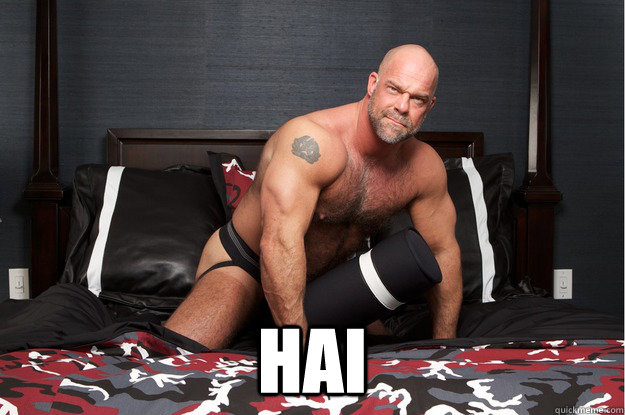
The image size is (625, 415). In order to click on chest in this screenshot , I will do `click(362, 188)`.